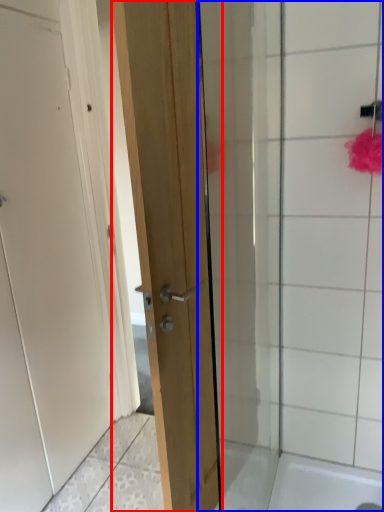
Question: Which point is further to the camera, door (highlighted by a red box) or shower door (highlighted by a blue box)?

Choices:
 (A) door
 (B) shower door

Answer: (B)